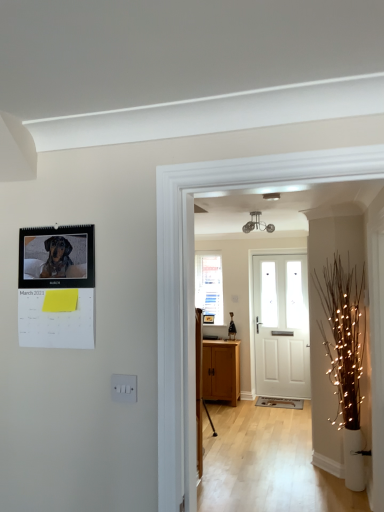
Question: Is clear glass window at center shorter than wooden cabinet at center?

Choices:
 (A) yes
 (B) no

Answer: (B)

Question: From a real-world perspective, is clear glass window at center on top of wooden cabinet at center?

Choices:
 (A) no
 (B) yes

Answer: (B)

Question: Could you tell me if clear glass window at center is turned towards wooden cabinet at center?

Choices:
 (A) yes
 (B) no

Answer: (B)

Question: From the image's perspective, would you say clear glass window at center is positioned over wooden cabinet at center?

Choices:
 (A) no
 (B) yes

Answer: (B)

Question: Considering the relative sizes of clear glass window at center and wooden cabinet at center in the image provided, is clear glass window at center taller than wooden cabinet at center?

Choices:
 (A) yes
 (B) no

Answer: (A)

Question: From the image's perspective, is clear glass window at center located beneath wooden cabinet at center?

Choices:
 (A) no
 (B) yes

Answer: (A)

Question: Does clear glass window at center have a greater height compared to illuminated twig at right?

Choices:
 (A) yes
 (B) no

Answer: (B)

Question: Is clear glass window at center positioned before illuminated twig at right?

Choices:
 (A) no
 (B) yes

Answer: (A)

Question: Is illuminated twig at right completely or partially inside clear glass window at center?

Choices:
 (A) yes
 (B) no

Answer: (B)

Question: Is clear glass window at center shorter than illuminated twig at right?

Choices:
 (A) yes
 (B) no

Answer: (A)

Question: Is clear glass window at center far from illuminated twig at right?

Choices:
 (A) yes
 (B) no

Answer: (A)

Question: Is clear glass window at center placed right next to illuminated twig at right?

Choices:
 (A) no
 (B) yes

Answer: (A)

Question: Is white painted wood door at center in contact with wooden cabinet at center?

Choices:
 (A) yes
 (B) no

Answer: (B)